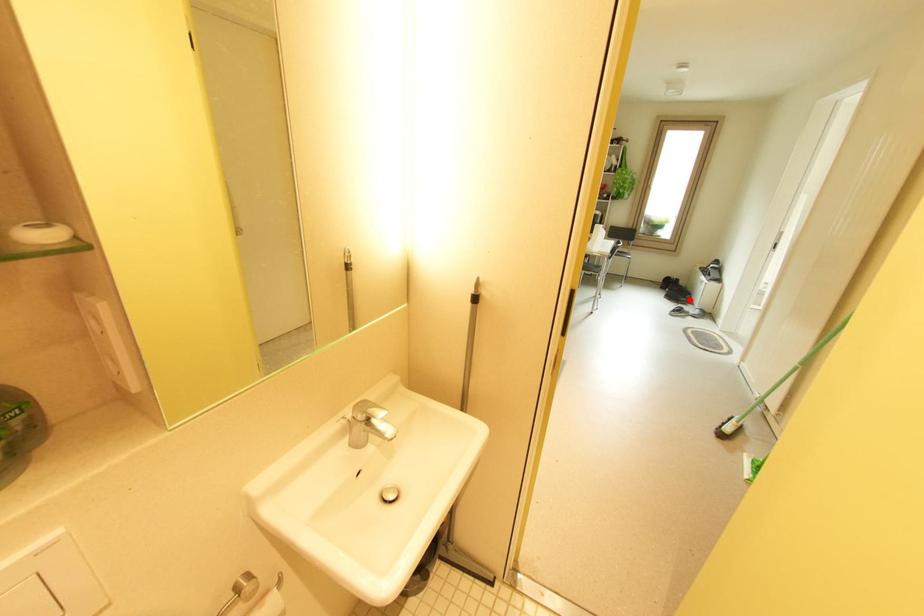
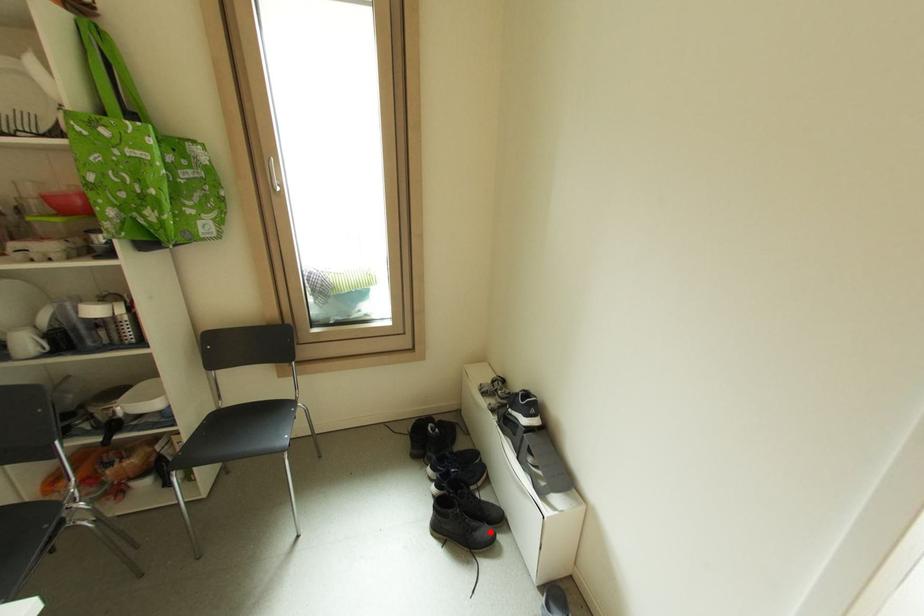
I am providing you with two images of the same scene from different viewpoints. A red point is marked on the first image and another point is marked on the second image. Is the red point in image1 aligned with the point shown in image2?

Yes